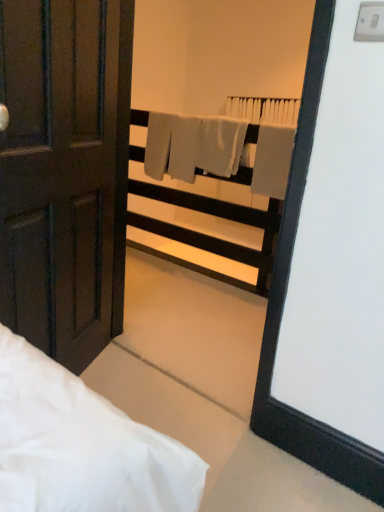
Question: Is white plastic balustrade at upper center positioned behind gray matte towel at center?

Choices:
 (A) no
 (B) yes

Answer: (B)

Question: From a real-world perspective, does white plastic balustrade at upper center stand above gray matte towel at center?

Choices:
 (A) no
 (B) yes

Answer: (A)

Question: From the image's perspective, would you say white plastic balustrade at upper center is shown under gray matte towel at center?

Choices:
 (A) no
 (B) yes

Answer: (B)

Question: From a real-world perspective, is white plastic balustrade at upper center below gray matte towel at center?

Choices:
 (A) yes
 (B) no

Answer: (A)

Question: Is white plastic balustrade at upper center looking in the opposite direction of gray matte towel at center?

Choices:
 (A) no
 (B) yes

Answer: (B)

Question: Can you confirm if white plastic balustrade at upper center is smaller than gray matte towel at center?

Choices:
 (A) no
 (B) yes

Answer: (A)

Question: Considering the relative positions of gray matte towel at center and matte dark brown door at left in the image provided, is gray matte towel at center behind matte dark brown door at left?

Choices:
 (A) yes
 (B) no

Answer: (A)

Question: Can you confirm if gray matte towel at center is shorter than matte dark brown door at left?

Choices:
 (A) yes
 (B) no

Answer: (A)

Question: Would you say matte dark brown door at left is part of gray matte towel at center's contents?

Choices:
 (A) yes
 (B) no

Answer: (B)

Question: Are gray matte towel at center and matte dark brown door at left far apart?

Choices:
 (A) no
 (B) yes

Answer: (B)

Question: Can you confirm if gray matte towel at center is positioned to the right of matte dark brown door at left?

Choices:
 (A) yes
 (B) no

Answer: (A)

Question: From a real-world perspective, is gray matte towel at center located higher than matte dark brown door at left?

Choices:
 (A) yes
 (B) no

Answer: (A)

Question: Considering the relative sizes of matte dark brown door at left and white plastic balustrade at upper center in the image provided, is matte dark brown door at left smaller than white plastic balustrade at upper center?

Choices:
 (A) no
 (B) yes

Answer: (B)